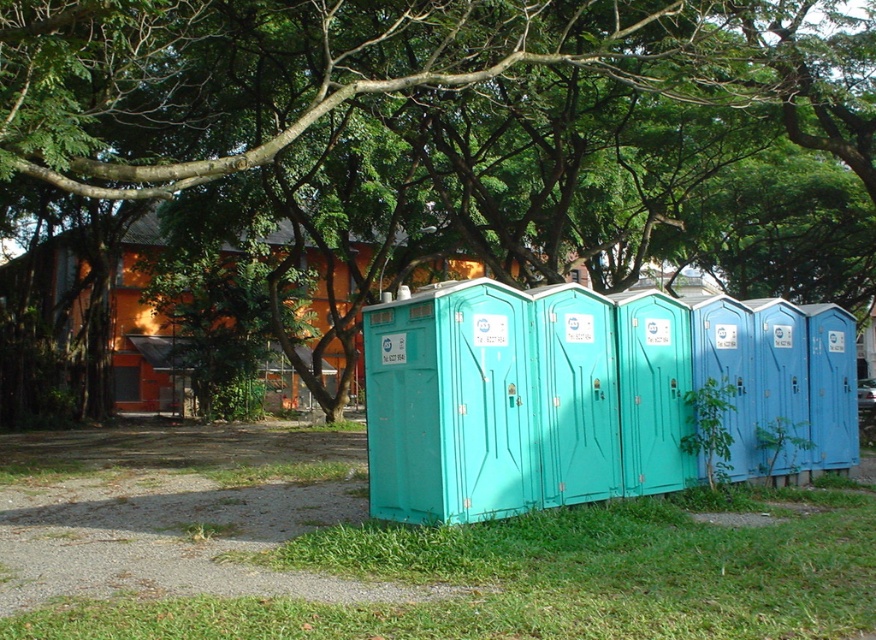
Can you confirm if green grass at lower center is wider than teal plastic porta-potty at center?

No, green grass at lower center is not wider than teal plastic porta-potty at center.

Which is above, green grass at lower center or teal plastic porta-potty at center?

teal plastic porta-potty at center is above.

Which is in front, point (525, 605) or point (256, 349)?

Positioned in front is point (525, 605).

This screenshot has height=640, width=876. In order to click on green grass at lower center in this screenshot , I will do `click(555, 576)`.

Which is more to the left, green leafy tree at upper center or green grass at lower center?

green grass at lower center is more to the left.

Does green leafy tree at upper center have a lesser height compared to green grass at lower center?

No, green leafy tree at upper center is not shorter than green grass at lower center.

Between point (546, 20) and point (679, 532), which one is positioned in front?

Positioned in front is point (679, 532).

Where is `green leafy tree at upper center`? The width and height of the screenshot is (876, 640). green leafy tree at upper center is located at coordinates (420, 97).

Between point (705, 10) and point (312, 266), which one is positioned behind?

The point (312, 266) is more distant.

Does green leafy tree at upper center appear over teal plastic porta-potty at center?

Indeed, green leafy tree at upper center is positioned over teal plastic porta-potty at center.

What do you see at coordinates (420, 97) in the screenshot? I see `green leafy tree at upper center` at bounding box center [420, 97].

The image size is (876, 640). What are the coordinates of `green leafy tree at upper center` in the screenshot? It's located at (420, 97).